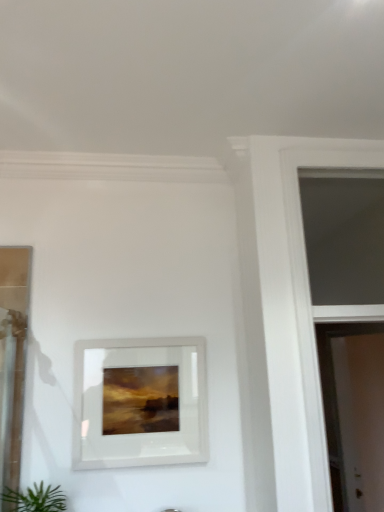
Question: Is white glossy picture frame at center in front of or behind transparent glass window at upper right in the image?

Choices:
 (A) front
 (B) behind

Answer: (B)

Question: Choose the correct answer: Is white glossy picture frame at center inside transparent glass window at upper right or outside it?

Choices:
 (A) outside
 (B) inside

Answer: (A)

Question: Which object is the farthest from the white glossy screen door at right?

Choices:
 (A) green leafy plant at lower left
 (B) transparent glass window at upper right
 (C) white glossy picture frame at center

Answer: (A)

Question: Considering the real-world distances, which object is closest to the white glossy picture frame at center?

Choices:
 (A) transparent glass window at upper right
 (B) white glossy screen door at right
 (C) green leafy plant at lower left

Answer: (C)